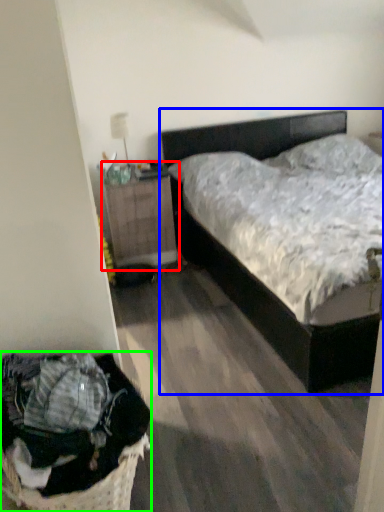
Question: Based on their relative distances, which object is nearer to nightstand (highlighted by a red box)? Choose from bed (highlighted by a blue box) and laundry basket (highlighted by a green box).

Choices:
 (A) bed
 (B) laundry basket

Answer: (A)